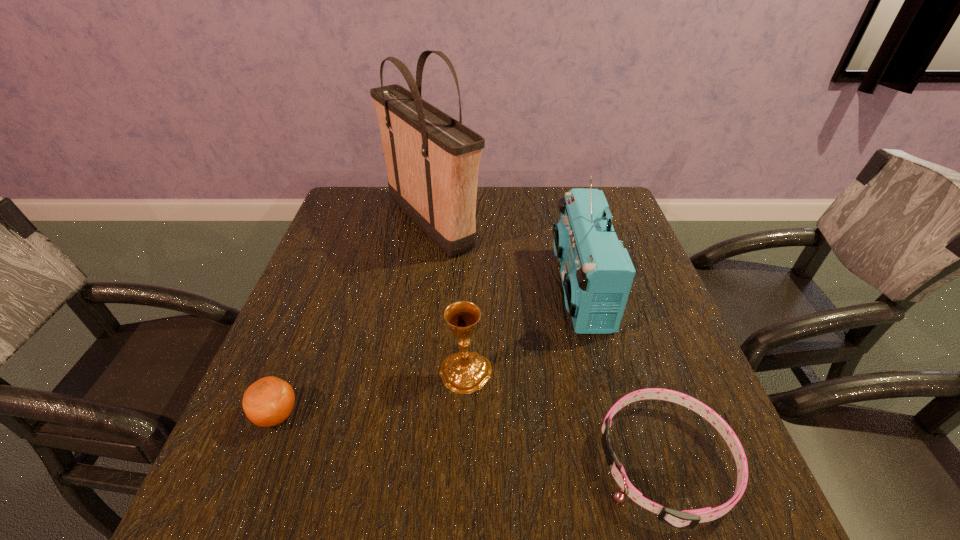
I want to click on object that stands as the closest to the second tallest object, so click(x=687, y=519).

This screenshot has height=540, width=960. Identify the location of object that ranks as the third closest to the shortest object. tap(432, 160).

The image size is (960, 540). What are the coordinates of `blank space that satisfies the following two spatial constraints: 1. on the front-facing side of the radio receiver; 2. on the front side of the fourth tallest object` in the screenshot? It's located at (612, 415).

Where is `vacant space that satisfies the following two spatial constraints: 1. on the front-facing side of the radio receiver; 2. on the front side of the fourth tallest object`? Image resolution: width=960 pixels, height=540 pixels. vacant space that satisfies the following two spatial constraints: 1. on the front-facing side of the radio receiver; 2. on the front side of the fourth tallest object is located at coordinates (612, 415).

Locate an element on the screen. blank area in the image that satisfies the following two spatial constraints: 1. on the front side of the chalice; 2. on the right side of the tallest object is located at coordinates (408, 372).